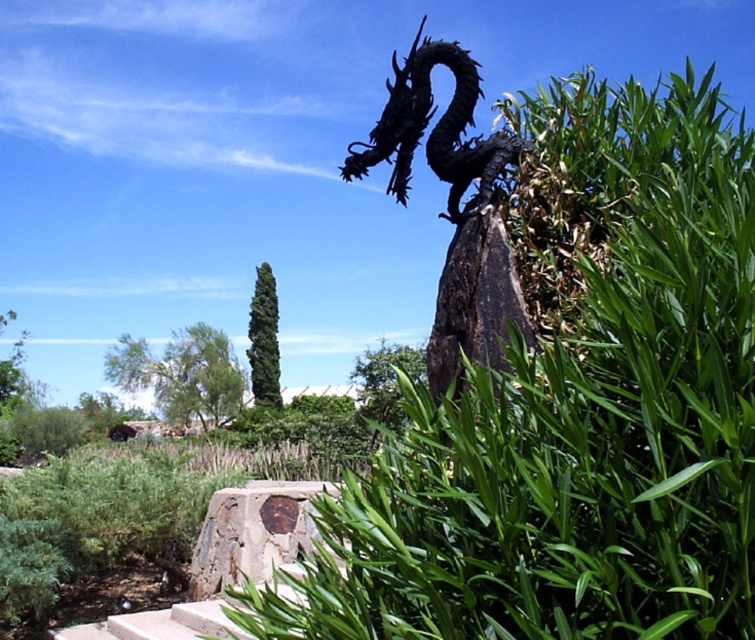
Question: Is rusty concrete block at center in front of green leafy bush at center?

Choices:
 (A) yes
 (B) no

Answer: (A)

Question: Which object appears farthest from the camera in this image?

Choices:
 (A) black metal dragon at upper center
 (B) green leafy bush at center

Answer: (B)

Question: Which point appears closest to the camera in this image?

Choices:
 (A) (470, 118)
 (B) (276, 388)
 (C) (230, 524)

Answer: (A)

Question: Which point is closer to the camera?

Choices:
 (A) pyautogui.click(x=288, y=513)
 (B) pyautogui.click(x=259, y=348)
 (C) pyautogui.click(x=492, y=154)

Answer: (C)

Question: Does black metal dragon at upper center appear on the right side of rusty concrete block at center?

Choices:
 (A) yes
 (B) no

Answer: (A)

Question: Is black metal dragon at upper center below green leafy bush at center?

Choices:
 (A) yes
 (B) no

Answer: (B)